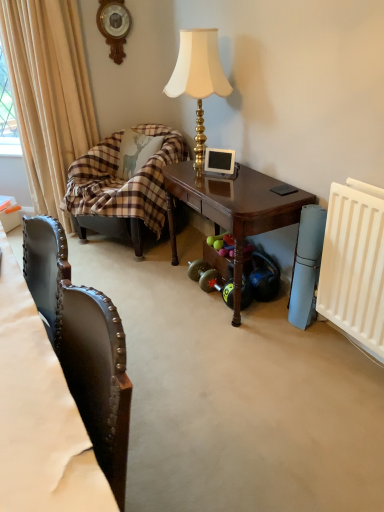
Question: Is leather at left touching white plastic radiator at right?

Choices:
 (A) yes
 (B) no

Answer: (B)

Question: Does leather at left have a smaller size compared to white plastic radiator at right?

Choices:
 (A) yes
 (B) no

Answer: (A)

Question: Does leather at left turn towards white plastic radiator at right?

Choices:
 (A) yes
 (B) no

Answer: (B)

Question: Is leather at left at the right side of white plastic radiator at right?

Choices:
 (A) no
 (B) yes

Answer: (A)

Question: Could white plastic radiator at right be considered to be inside leather at left?

Choices:
 (A) yes
 (B) no

Answer: (B)

Question: In the image, is beige fabric curtain at left positioned in front of or behind rubberized black dumbbell at lower right?

Choices:
 (A) behind
 (B) front

Answer: (A)

Question: Is beige fabric curtain at left bigger or smaller than rubberized black dumbbell at lower right?

Choices:
 (A) big
 (B) small

Answer: (A)

Question: From the image's perspective, is beige fabric curtain at left located above or below rubberized black dumbbell at lower right?

Choices:
 (A) above
 (B) below

Answer: (A)

Question: Is point (29, 144) closer or farther from the camera than point (261, 288)?

Choices:
 (A) farther
 (B) closer

Answer: (A)

Question: Considering the positions of point (97, 344) and point (84, 240), is point (97, 344) closer or farther from the camera than point (84, 240)?

Choices:
 (A) farther
 (B) closer

Answer: (B)

Question: In terms of width, does leather at left look wider or thinner when compared to plaid fabric couch at left?

Choices:
 (A) thin
 (B) wide

Answer: (B)

Question: Considering their positions, is leather at left located in front of or behind plaid fabric couch at left?

Choices:
 (A) front
 (B) behind

Answer: (A)

Question: From their relative heights in the image, would you say leather at left is taller or shorter than plaid fabric couch at left?

Choices:
 (A) tall
 (B) short

Answer: (B)

Question: Considering the positions of rubberized black dumbbell at lower right and plaid fabric couch at left in the image, is rubberized black dumbbell at lower right wider or thinner than plaid fabric couch at left?

Choices:
 (A) wide
 (B) thin

Answer: (B)

Question: Is rubberized black dumbbell at lower right in front of or behind plaid fabric couch at left in the image?

Choices:
 (A) front
 (B) behind

Answer: (A)